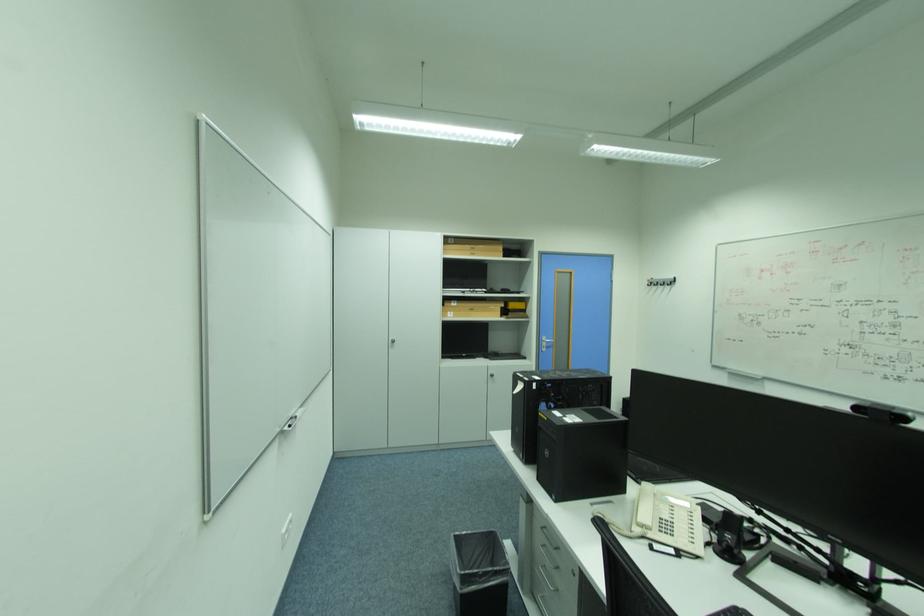
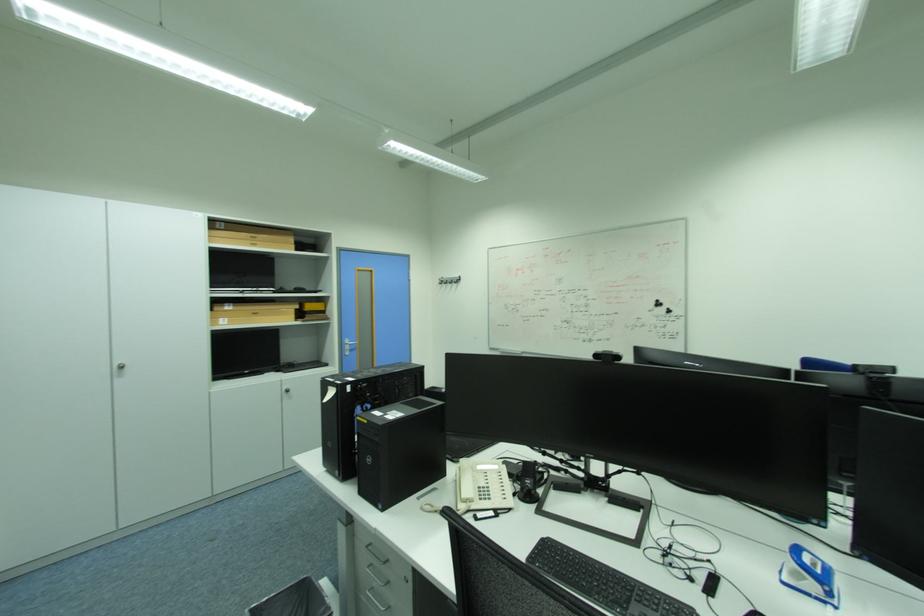
The point at (553, 565) is marked in the first image. Where is the corresponding point in the second image?

(382, 585)